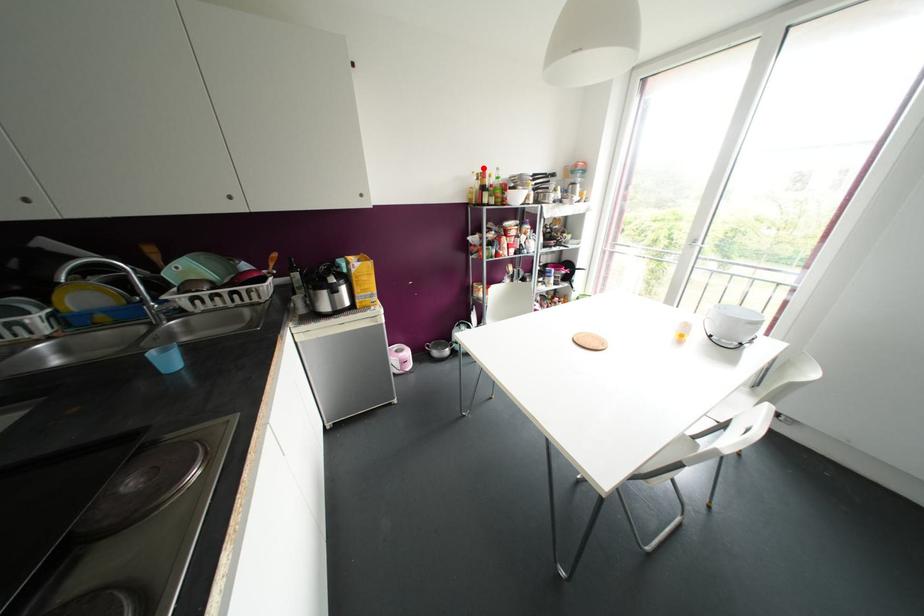
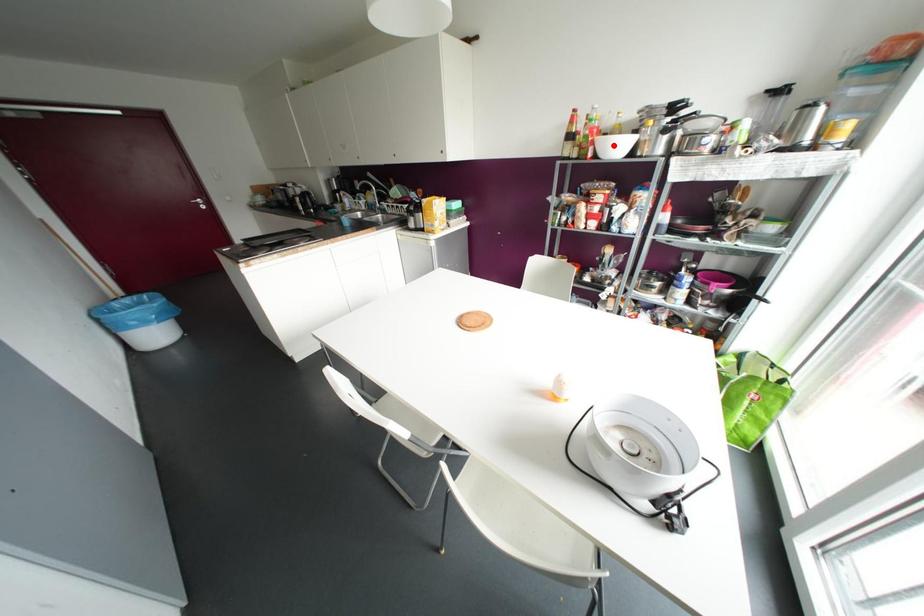
I am providing you with two images of the same scene from different viewpoints. A red point is marked on the first image and another point is marked on the second image. Are the points marked in image1 and image2 representing the same 3D position?

No